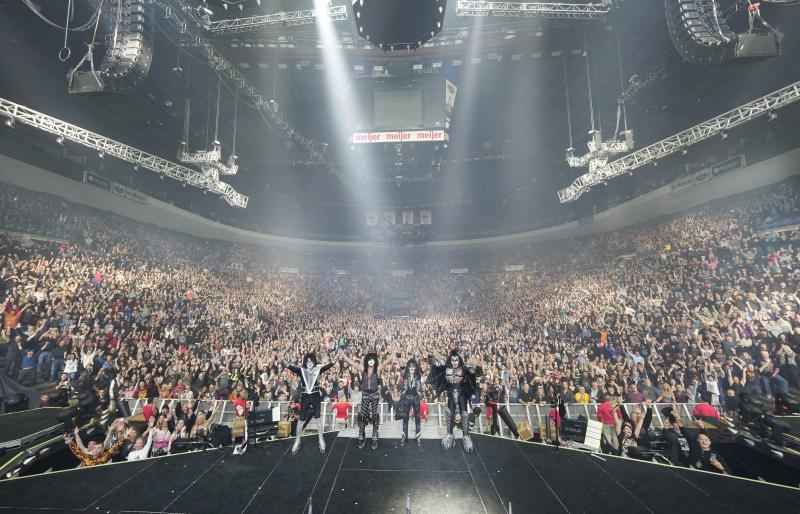
At what (x,y) coordinates should I click in order to perform the action: click on light. Please return your answer as a coordinate pair (x, y). Looking at the image, I should click on (334, 67).